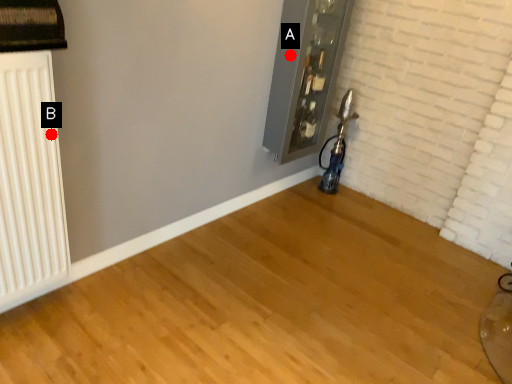
Question: Two points are circled on the image, labeled by A and B beside each circle. Among these points, which one is nearest to the camera?

Choices:
 (A) A is closer
 (B) B is closer

Answer: (B)